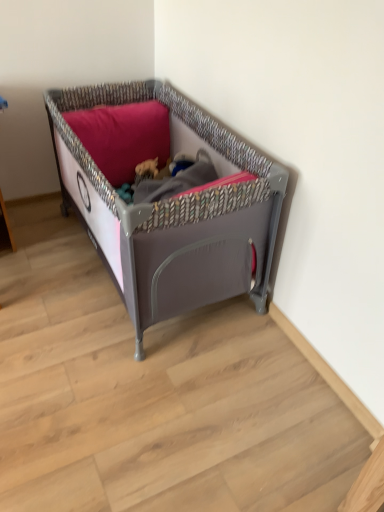
Locate an element on the screen. This screenshot has height=512, width=384. matte pink pillow at upper center is located at coordinates (123, 137).

The width and height of the screenshot is (384, 512). What do you see at coordinates (123, 137) in the screenshot?
I see `matte pink pillow at upper center` at bounding box center [123, 137].

What do you see at coordinates (166, 199) in the screenshot? I see `matte gray plastic playpen at center` at bounding box center [166, 199].

Find the location of a particular element. matte gray plastic playpen at center is located at coordinates (x=166, y=199).

You are a GUI agent. You are given a task and a screenshot of the screen. Output one action in this format:
    pyautogui.click(x=<x>, y=<y>)
    Task: Click on the matte pink pillow at upper center
    
    Given the screenshot: What is the action you would take?
    (123, 137)

Which object is positioned more to the left, matte gray plastic playpen at center or matte pink pillow at upper center?

Positioned to the left is matte pink pillow at upper center.

Which object is further away from the camera, matte gray plastic playpen at center or matte pink pillow at upper center?

matte pink pillow at upper center is behind.

Is point (190, 209) positioned after point (104, 122)?

No, it is in front of (104, 122).

From the image's perspective, is matte gray plastic playpen at center above or below matte pink pillow at upper center?

Clearly, from the image's perspective, matte gray plastic playpen at center is below matte pink pillow at upper center.

From a real-world perspective, is matte gray plastic playpen at center positioned above or below matte pink pillow at upper center?

Clearly, from a real-world perspective, matte gray plastic playpen at center is below matte pink pillow at upper center.

Which of these two, matte gray plastic playpen at center or matte pink pillow at upper center, is thinner?

matte pink pillow at upper center is thinner.

Which of these two, matte gray plastic playpen at center or matte pink pillow at upper center, stands shorter?

Standing shorter between the two is matte pink pillow at upper center.

Who is smaller, matte gray plastic playpen at center or matte pink pillow at upper center?

Smaller between the two is matte pink pillow at upper center.

Is matte pink pillow at upper center located within matte gray plastic playpen at center?

Yes.

Is matte gray plastic playpen at center far from matte pink pillow at upper center?

No.

Could you tell me if matte gray plastic playpen at center is turned towards matte pink pillow at upper center?

Yes, matte gray plastic playpen at center faces towards matte pink pillow at upper center.

Can you tell me how much matte gray plastic playpen at center and matte pink pillow at upper center differ in facing direction?

4.9e-06 degrees separate the facing orientations of matte gray plastic playpen at center and matte pink pillow at upper center.

Locate an element on the screen. This screenshot has height=512, width=384. pillow above the matte gray plastic playpen at center (from a real-world perspective) is located at coordinates (123, 137).

Is matte pink pillow at upper center at the right side of matte gray plastic playpen at center?

No.

Relative to matte gray plastic playpen at center, is matte pink pillow at upper center in front or behind?

matte pink pillow at upper center is positioned farther from the viewer than matte gray plastic playpen at center.

Which is behind, point (87, 125) or point (99, 205)?

The point (87, 125) is farther from the camera.

Looking at this image, from the image's perspective, is matte pink pillow at upper center located beneath matte gray plastic playpen at center?

No, from the image's perspective, matte pink pillow at upper center is not beneath matte gray plastic playpen at center.

From a real-world perspective, is matte pink pillow at upper center positioned above or below matte gray plastic playpen at center?

Clearly, from a real-world perspective, matte pink pillow at upper center is above matte gray plastic playpen at center.

Which object is wider, matte pink pillow at upper center or matte gray plastic playpen at center?

matte gray plastic playpen at center is wider.

Considering the sizes of objects matte pink pillow at upper center and matte gray plastic playpen at center in the image provided, who is taller, matte pink pillow at upper center or matte gray plastic playpen at center?

With more height is matte gray plastic playpen at center.

Does matte pink pillow at upper center have a larger size compared to matte gray plastic playpen at center?

No, matte pink pillow at upper center is not bigger than matte gray plastic playpen at center.

Would you say matte pink pillow at upper center is inside or outside matte gray plastic playpen at center?

matte pink pillow at upper center is spatially positioned inside matte gray plastic playpen at center.

Is matte pink pillow at upper center not near matte gray plastic playpen at center?

No.

Is matte pink pillow at upper center facing towards matte gray plastic playpen at center?

Yes, matte pink pillow at upper center is facing matte gray plastic playpen at center.

How much distance is there between matte pink pillow at upper center and matte gray plastic playpen at center?

They are 11.02 inches apart.

You are a GUI agent. You are given a task and a screenshot of the screen. Output one action in this format:
    pyautogui.click(x=<x>, y=<y>)
    Task: Click on the pillow that is above the matte gray plastic playpen at center (from the image's perspective)
    
    Given the screenshot: What is the action you would take?
    (123, 137)

Where is `pillow that is above the matte gray plastic playpen at center (from a real-world perspective)`? pillow that is above the matte gray plastic playpen at center (from a real-world perspective) is located at coordinates (123, 137).

Locate an element on the screen. infant bed lying below the matte pink pillow at upper center (from the image's perspective) is located at coordinates (166, 199).